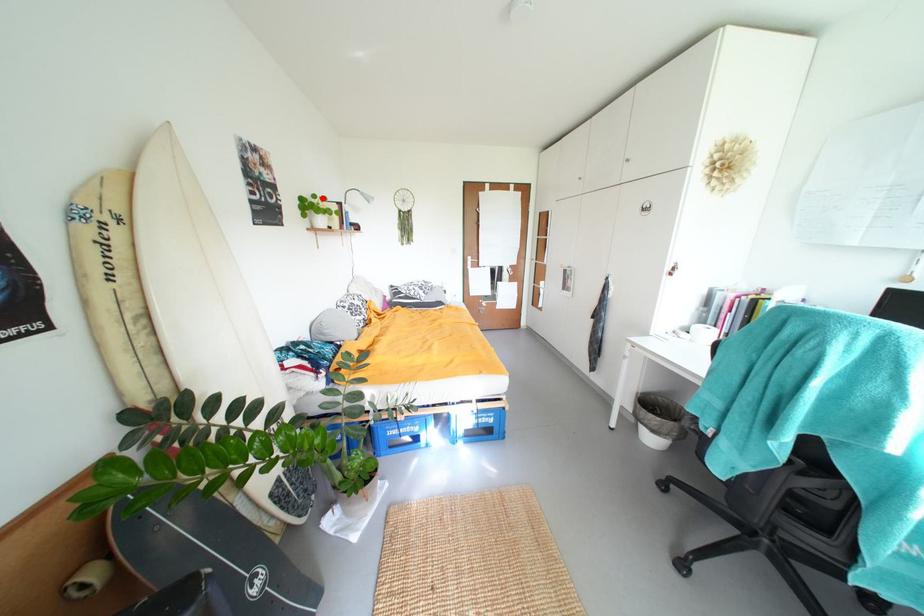
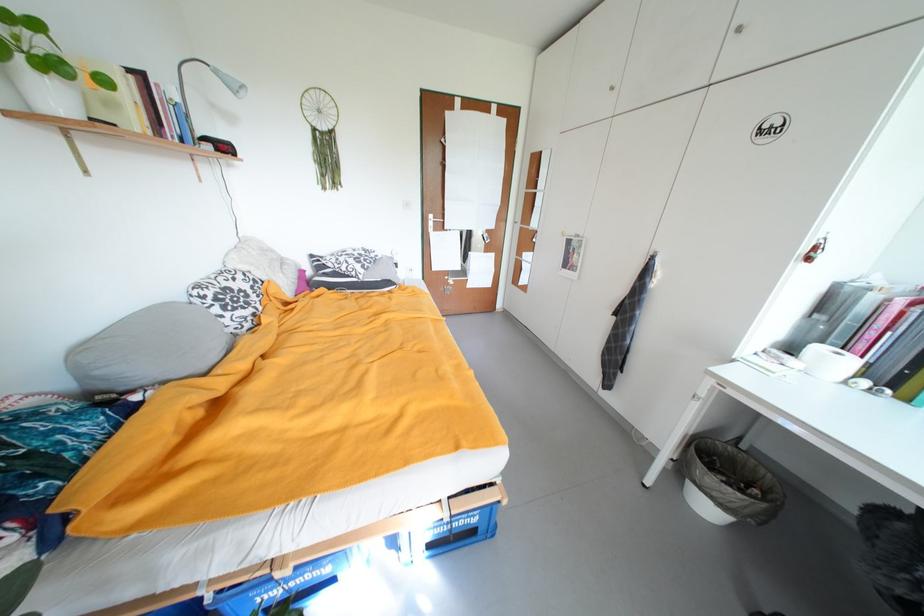
The point at the highlighted location is marked in the first image. Where is the corresponding point in the second image?

(15, 18)